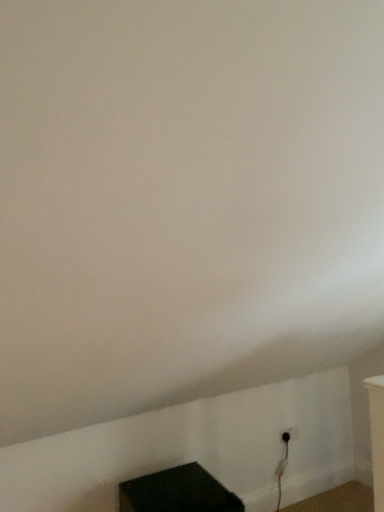
Describe the element at coordinates (177, 492) in the screenshot. The image size is (384, 512). I see `black matte cube at lower center` at that location.

Where is `black matte cube at lower center`? black matte cube at lower center is located at coordinates (177, 492).

Locate an element on the screen. black plastic outlet at lower right is located at coordinates (289, 435).

What do you see at coordinates (289, 435) in the screenshot?
I see `black plastic outlet at lower right` at bounding box center [289, 435].

Looking at this image, measure the distance between black plastic outlet at lower right and camera.

black plastic outlet at lower right is 8.86 feet away from camera.

Locate an element on the screen. black matte cube at lower center is located at coordinates (177, 492).

Is black plastic outlet at lower right at the right side of black matte cube at lower center?

Indeed, black plastic outlet at lower right is positioned on the right side of black matte cube at lower center.

Between black plastic outlet at lower right and black matte cube at lower center, which one is positioned in front?

black matte cube at lower center is more forward.

Which point is more forward, (287, 431) or (169, 497)?

The point (169, 497) is closer.

From the image's perspective, is black plastic outlet at lower right over black matte cube at lower center?

Yes, from the image's perspective, black plastic outlet at lower right is on top of black matte cube at lower center.

Looking at this image, from a real-world perspective, is black plastic outlet at lower right above or below black matte cube at lower center?

black plastic outlet at lower right is above black matte cube at lower center.

Which object is wider, black plastic outlet at lower right or black matte cube at lower center?

black matte cube at lower center is wider.

Who is shorter, black plastic outlet at lower right or black matte cube at lower center?

Standing shorter between the two is black plastic outlet at lower right.

Which of these two, black plastic outlet at lower right or black matte cube at lower center, is bigger?

black matte cube at lower center.

Can we say black plastic outlet at lower right lies outside black matte cube at lower center?

Yes, black plastic outlet at lower right is located beyond the bounds of black matte cube at lower center.

Is there a large distance between black plastic outlet at lower right and black matte cube at lower center?

No, black plastic outlet at lower right is in close proximity to black matte cube at lower center.

Is black plastic outlet at lower right oriented away from black matte cube at lower center?

No, black plastic outlet at lower right's orientation is not away from black matte cube at lower center.

How far apart are black plastic outlet at lower right and black matte cube at lower center?

37.63 inches.

Where is `furniture directly beneath the black plastic outlet at lower right (from a real-world perspective)`? furniture directly beneath the black plastic outlet at lower right (from a real-world perspective) is located at coordinates (177, 492).

Which is more to the left, black matte cube at lower center or black plastic outlet at lower right?

black matte cube at lower center.

Which is in front, black matte cube at lower center or black plastic outlet at lower right?

black matte cube at lower center is closer to the camera.

Which is behind, point (139, 490) or point (289, 430)?

The point (289, 430) is farther.

From the image's perspective, between black matte cube at lower center and black plastic outlet at lower right, which one is located above?

From the image's view, black plastic outlet at lower right is above.

From a real-world perspective, is black matte cube at lower center positioned under black plastic outlet at lower right based on gravity?

Yes, from a real-world perspective, black matte cube at lower center is beneath black plastic outlet at lower right.

Looking at their sizes, would you say black matte cube at lower center is wider or thinner than black plastic outlet at lower right?

black matte cube at lower center is wider than black plastic outlet at lower right.

Who is taller, black matte cube at lower center or black plastic outlet at lower right?

Standing taller between the two is black matte cube at lower center.

Based on the photo, which of these two, black matte cube at lower center or black plastic outlet at lower right, is bigger?

With larger size is black matte cube at lower center.

Would you say black matte cube at lower center is outside black plastic outlet at lower right?

Yes, black matte cube at lower center is not within black plastic outlet at lower right.

Is black matte cube at lower center far from black plastic outlet at lower right?

black matte cube at lower center is actually quite close to black plastic outlet at lower right.

Could you tell me if black matte cube at lower center is turned towards black plastic outlet at lower right?

No, black matte cube at lower center is not aimed at black plastic outlet at lower right.

How different are the orientations of black matte cube at lower center and black plastic outlet at lower right in degrees?

black matte cube at lower center and black plastic outlet at lower right are facing 0.00487 degrees away from each other.

How much distance is there between black matte cube at lower center and black plastic outlet at lower right?

black matte cube at lower center is 37.63 inches away from black plastic outlet at lower right.

Identify the location of electric outlet behind the black matte cube at lower center. This screenshot has width=384, height=512. (289, 435).

This screenshot has width=384, height=512. Identify the location of furniture below the black plastic outlet at lower right (from the image's perspective). (177, 492).

Where is `electric outlet above the black matte cube at lower center (from the image's perspective)`? electric outlet above the black matte cube at lower center (from the image's perspective) is located at coordinates (289, 435).